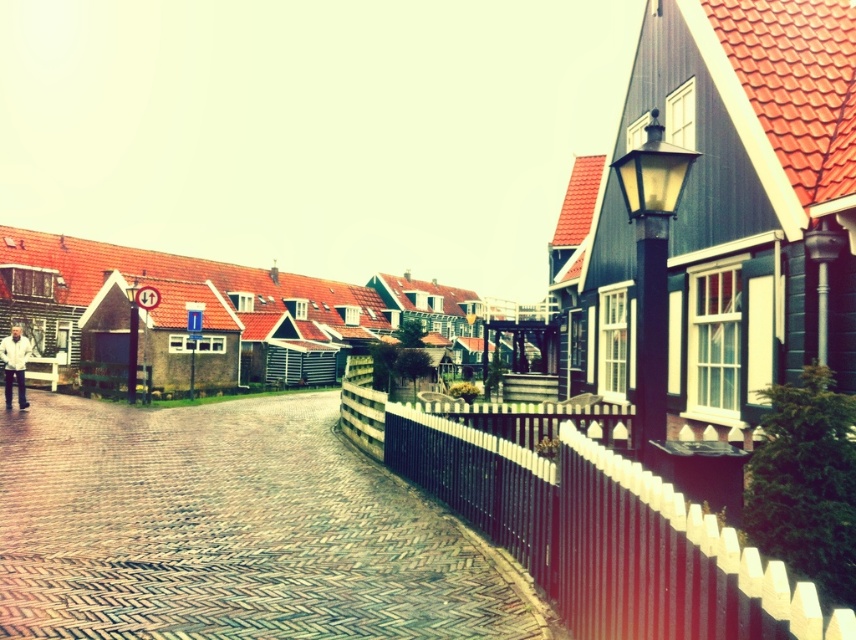
Which is above, black wooden fence at right or white matte jacket at left?

white matte jacket at left

Does point (782, 593) come closer to viewer compared to point (7, 392)?

Yes, point (782, 593) is closer to viewer.

The height and width of the screenshot is (640, 856). Describe the element at coordinates (592, 529) in the screenshot. I see `black wooden fence at right` at that location.

Find the location of a particular element. black wooden fence at right is located at coordinates (592, 529).

Is brown brick path at center shorter than white matte jacket at left?

Yes.

Who is more forward, (239, 532) or (19, 372)?

Point (239, 532) is in front.

Where is `brown brick path at center`? The image size is (856, 640). brown brick path at center is located at coordinates (229, 529).

Who is positioned more to the left, brown brick path at center or black wooden fence at right?

brown brick path at center

Is brown brick path at center shorter than black wooden fence at right?

Yes, brown brick path at center is shorter than black wooden fence at right.

Identify the location of brown brick path at center. The width and height of the screenshot is (856, 640). click(x=229, y=529).